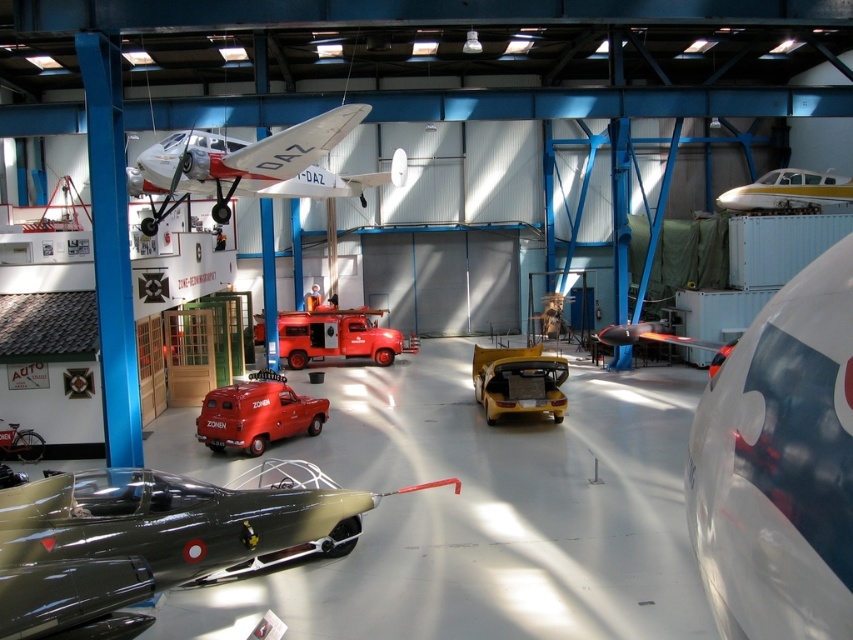
Is point (488, 355) positioned before point (795, 204)?

That is True.

Is point (508, 385) behind point (770, 188)?

No, (508, 385) is closer to viewer.

Is point (531, 362) in front of point (833, 196)?

That is True.

Image resolution: width=853 pixels, height=640 pixels. I want to click on yellow matte car at center, so tap(518, 381).

The width and height of the screenshot is (853, 640). Find the location of `metallic olive green car at lower left`. metallic olive green car at lower left is located at coordinates (149, 540).

Who is more distant from viewer, (334, 136) or (231, 417)?

Point (231, 417)

Looking at this image, who is positioned more to the right, white matte airplane at upper center or matte red van at center?

white matte airplane at upper center

At what (x,y) coordinates should I click in order to perform the action: click on white matte airplane at upper center. Please return your answer as a coordinate pair (x, y). Image resolution: width=853 pixels, height=640 pixels. Looking at the image, I should click on (254, 166).

The image size is (853, 640). Find the location of `white matte airplane at upper center`. white matte airplane at upper center is located at coordinates (254, 166).